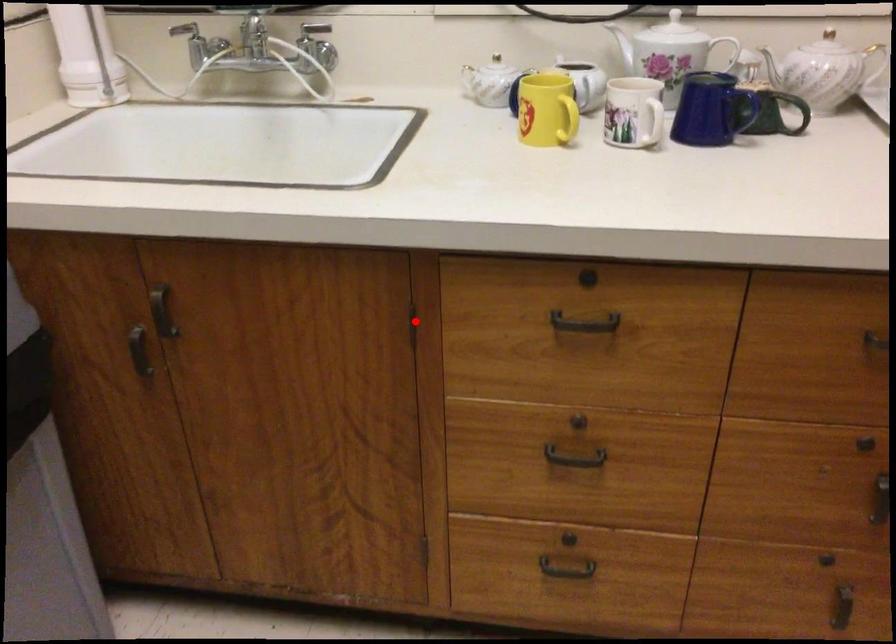
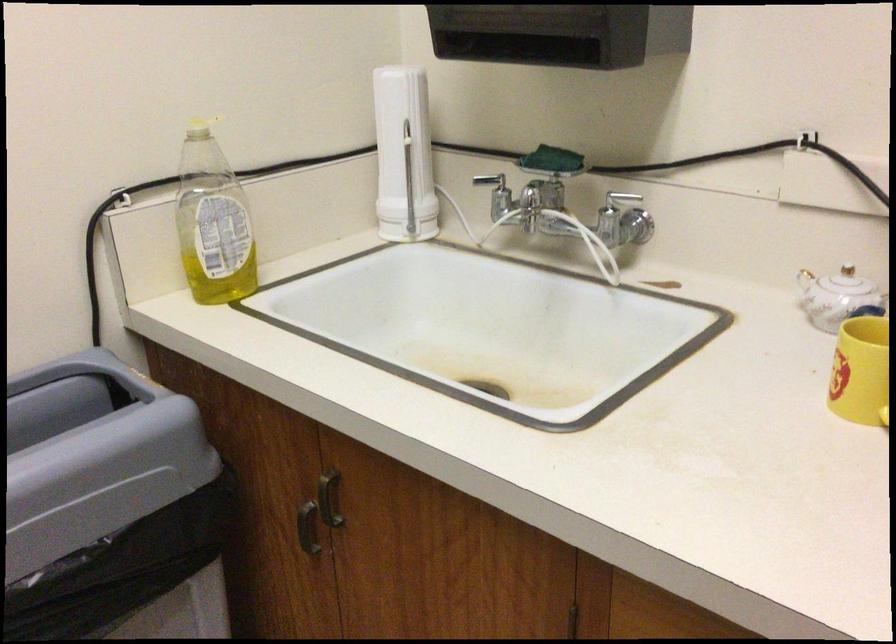
Question: A red point is marked in image1. In image2, is the corresponding 3D point closer to the camera or farther? Reply with the corresponding letter.

Choices:
 (A) The corresponding 3D point is closer.
 (B) The corresponding 3D point is farther.

Answer: (A)